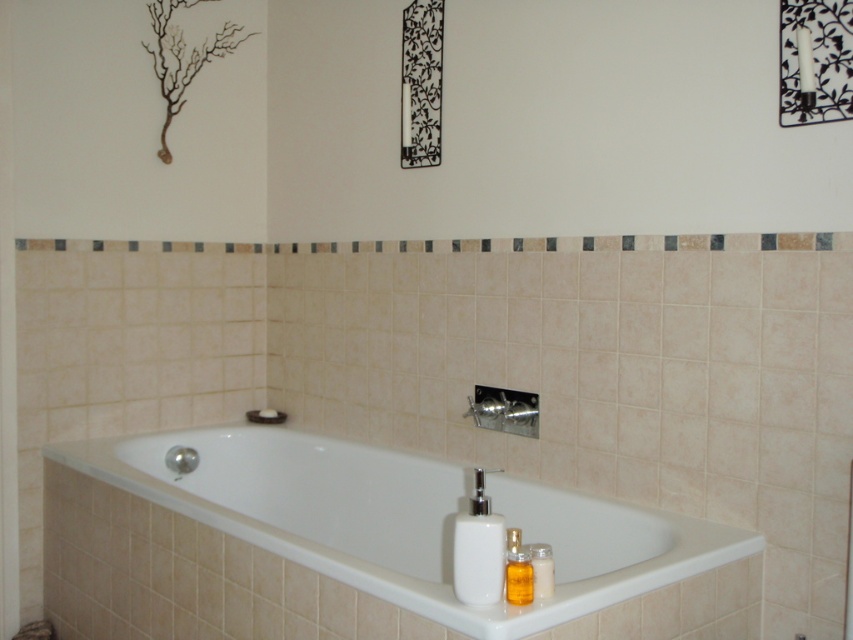
Does white glossy bathtub at center lie in front of translucent plastic bottle at lower right?

Yes, it is in front of translucent plastic bottle at lower right.

Is white glossy bathtub at center positioned at the back of translucent plastic bottle at lower right?

No, it is not.

Find the location of `white glossy bathtub at center`. white glossy bathtub at center is located at coordinates (357, 547).

This screenshot has width=853, height=640. Identify the location of white glossy bathtub at center. (357, 547).

Is translucent plastic bottle at lower right closer to the viewer compared to white matte soap at upper left?

That is True.

Is translucent plastic bottle at lower right wider than white matte soap at upper left?

No, translucent plastic bottle at lower right is not wider than white matte soap at upper left.

This screenshot has height=640, width=853. What do you see at coordinates (543, 570) in the screenshot? I see `translucent plastic bottle at lower right` at bounding box center [543, 570].

Identify the location of translucent plastic bottle at lower right. This screenshot has width=853, height=640. (543, 570).

Can you confirm if white glossy soap dispenser at center is positioned to the left of translucent plastic bottle at lower right?

Yes, white glossy soap dispenser at center is to the left of translucent plastic bottle at lower right.

Which is below, white glossy soap dispenser at center or translucent plastic bottle at lower right?

translucent plastic bottle at lower right is lower down.

Between point (453, 540) and point (531, 556), which one is positioned behind?

Point (453, 540)

You are a GUI agent. You are given a task and a screenshot of the screen. Output one action in this format:
    pyautogui.click(x=<x>, y=<y>)
    Task: Click on the white glossy soap dispenser at center
    
    Given the screenshot: What is the action you would take?
    pyautogui.click(x=479, y=548)